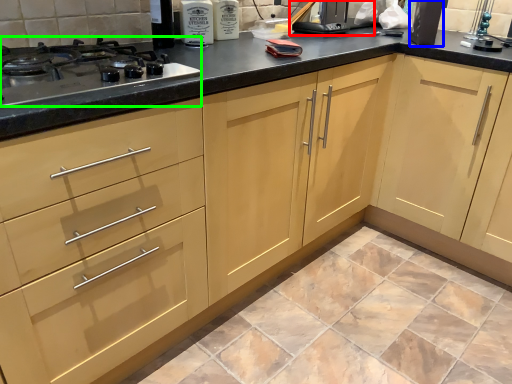
Question: Considering the real-world distances, which object is closest to appliance (highlighted by a red box)? appliance (highlighted by a blue box) or gas stove (highlighted by a green box).

Choices:
 (A) appliance
 (B) gas stove

Answer: (A)